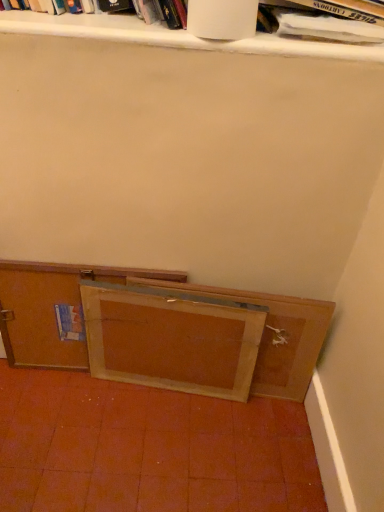
Question: Considering the positions of wooden cabinet at lower left, the 2th cabinetry in the right-to-left sequence, and white matte book at upper center, placed as the 1th book when sorted from left to right, in the image, is wooden cabinet at lower left, the 2th cabinetry in the right-to-left sequence, wider or thinner than white matte book at upper center, placed as the 1th book when sorted from left to right,?

Choices:
 (A) wide
 (B) thin

Answer: (B)

Question: Choose the correct answer: Is wooden cabinet at lower left, which ranks as the first cabinetry in left-to-right order, inside white matte book at upper center, the second book viewed from the right, or outside it?

Choices:
 (A) outside
 (B) inside

Answer: (A)

Question: Considering the real-world distances, which object is farthest from the white paper at upper right, which ranks as the second book in left-to-right order?

Choices:
 (A) wooden cabinet at lower left, the 2th cabinetry in the right-to-left sequence
 (B) white matte book at upper center, placed as the 1th book when sorted from left to right
 (C) wooden frame at lower center
 (D) wooden frame at lower center, the 1th cabinetry viewed from the right

Answer: (A)

Question: Estimate the real-world distances between objects in this image. Which object is farther from the white matte book at upper center, the second book viewed from the right?

Choices:
 (A) wooden frame at lower center
 (B) wooden frame at lower center, the 1th cabinetry viewed from the right
 (C) wooden cabinet at lower left, the 2th cabinetry in the right-to-left sequence
 (D) white paper at upper right, the first book in the right-to-left sequence

Answer: (A)